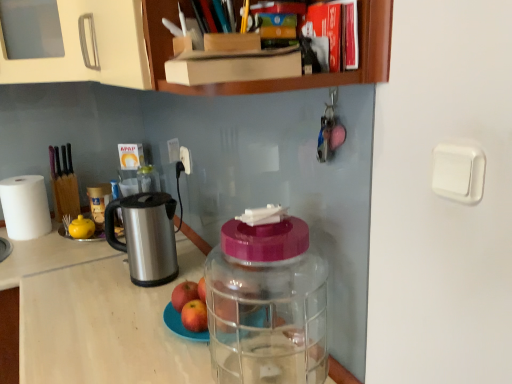
I want to click on vacant space situated on the left part of stainless steel electric kettle at left, so click(x=92, y=279).